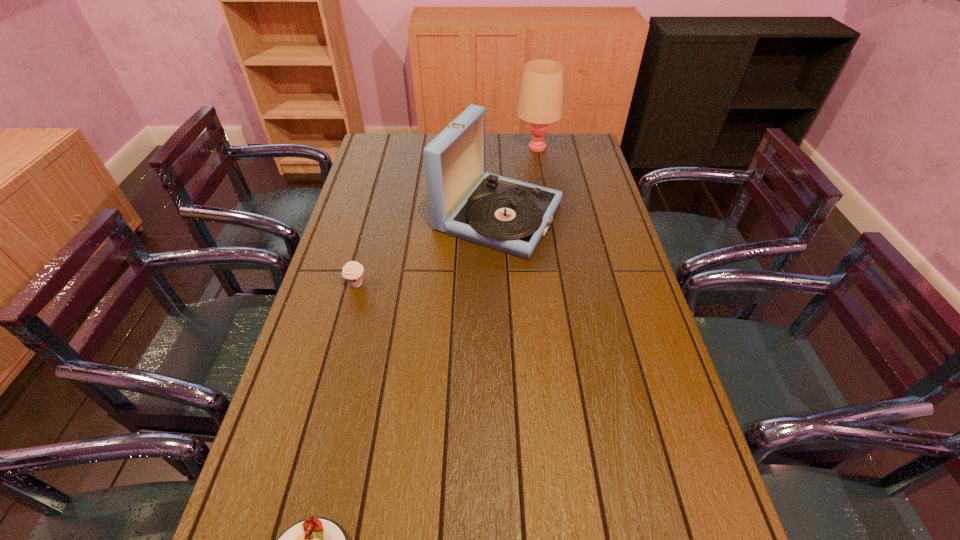
Locate an element on the screen. The height and width of the screenshot is (540, 960). the second closest object to the sandwich is located at coordinates (509, 215).

You are a GUI agent. You are given a task and a screenshot of the screen. Output one action in this format:
    pyautogui.click(x=<x>, y=<y>)
    Task: Click on the blank area in the image that satisfies the following two spatial constraints: 1. on the back side of the third farthest object; 2. on the left side of the phonograph record
    This screenshot has width=960, height=540.
    Given the screenshot: What is the action you would take?
    pyautogui.click(x=374, y=217)

The width and height of the screenshot is (960, 540). Identify the location of free space that satisfies the following two spatial constraints: 1. on the back side of the third tallest object; 2. on the right side of the third nearest object. (374, 217).